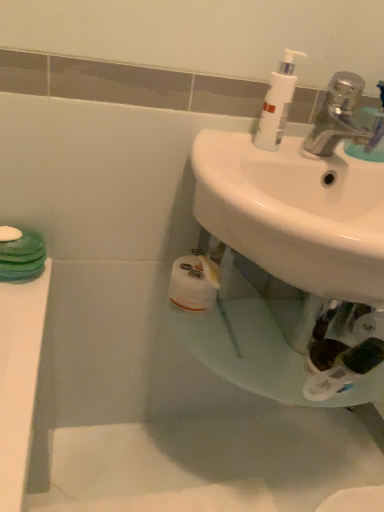
Question: Based on their sizes in the image, would you say silver metallic faucet at upper right is bigger or smaller than white glossy sink at center?

Choices:
 (A) small
 (B) big

Answer: (A)

Question: From the image's perspective, relative to white glossy sink at center, is silver metallic faucet at upper right above or below?

Choices:
 (A) below
 (B) above

Answer: (B)

Question: Which of these objects is positioned closest to the white plastic pump bottle at upper right?

Choices:
 (A) white glossy sink at center
 (B) silver metallic faucet at upper right

Answer: (B)

Question: Based on their relative distances, which object is farther from the white plastic pump bottle at upper right?

Choices:
 (A) silver metallic faucet at upper right
 (B) white glossy sink at center

Answer: (B)